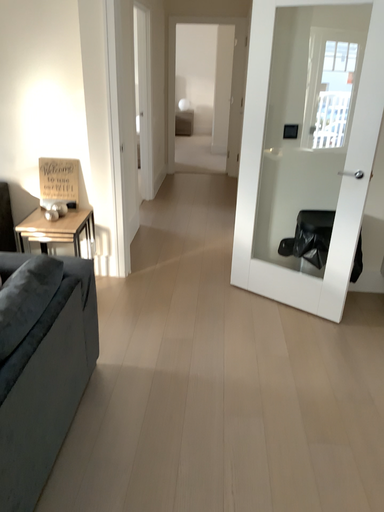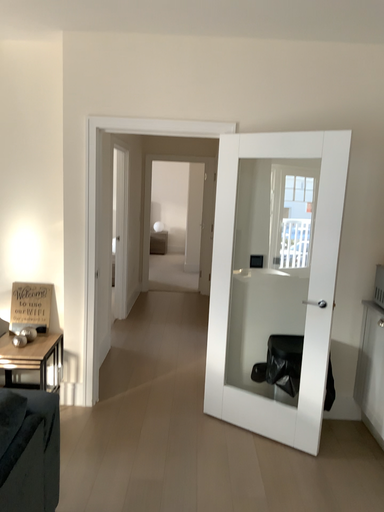
Question: Which way did the camera rotate in the video?

Choices:
 (A) rotated downward
 (B) rotated upward

Answer: (B)